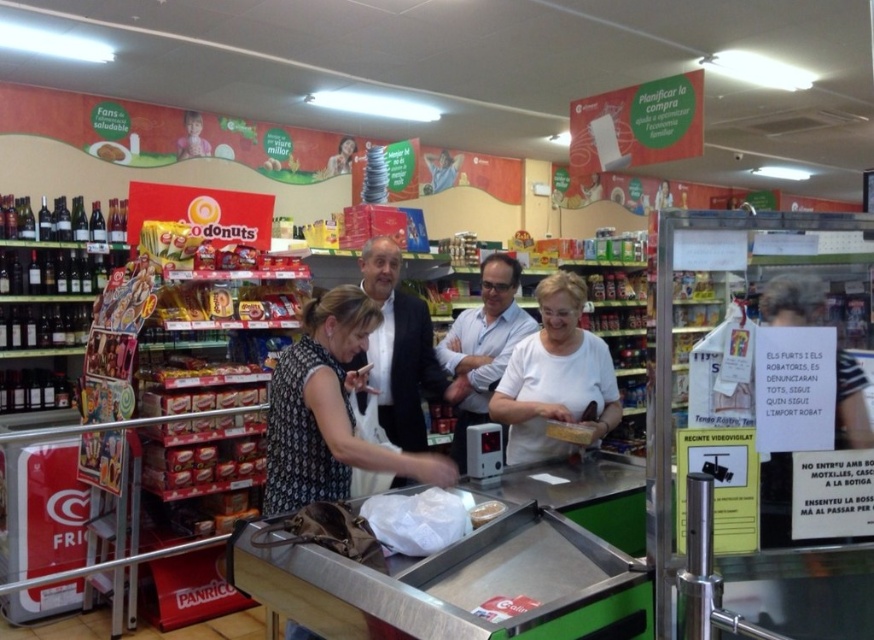
You are a customer in a convenience store looking for snacks. You see a translucent plastic container at center and a matte cardboard snack at center. Which one is smaller in size?

The translucent plastic container at center is smaller compared to the matte cardboard snack at center.

You are standing in the convenience store and want to pick up both items located at point (x=403, y=417) and point (x=96, y=150). Which item should you pick up first to minimize the distance you walk?

A: You should pick up the item at point (x=403, y=417) first because it is closer to you than point (x=96, y=150), so reaching it first requires less walking distance.